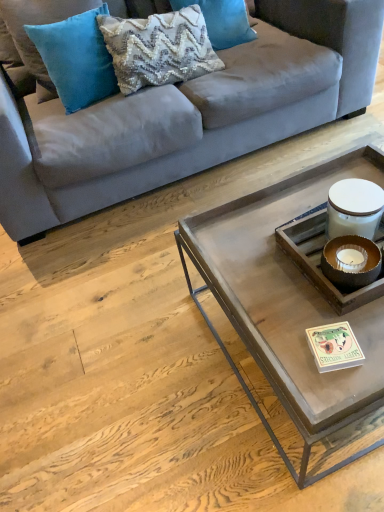
Question: Is point [230, 45] closer or farther from the camera than point [206, 110]?

Choices:
 (A) farther
 (B) closer

Answer: (A)

Question: Considering their positions, is woven fabric pillow at upper center, the first pillow in the right-to-left sequence, located in front of or behind suede gray couch at upper center?

Choices:
 (A) behind
 (B) front

Answer: (A)

Question: Which object is the farthest from the textured cream pillow at upper center, which is the second pillow from right to left?

Choices:
 (A) teal velvet pillow at upper left, arranged as the 3th pillow when viewed from the right
 (B) woven fabric pillow at upper center, the first pillow in the right-to-left sequence
 (C) metallic gray tray at center
 (D) suede gray couch at upper center

Answer: (C)

Question: Which of these objects is positioned farthest from the metallic gray tray at center?

Choices:
 (A) teal velvet pillow at upper left, which is the 1th pillow from left to right
 (B) woven fabric pillow at upper center, the 3th pillow viewed from the left
 (C) suede gray couch at upper center
 (D) textured cream pillow at upper center, which is the second pillow from right to left

Answer: (B)